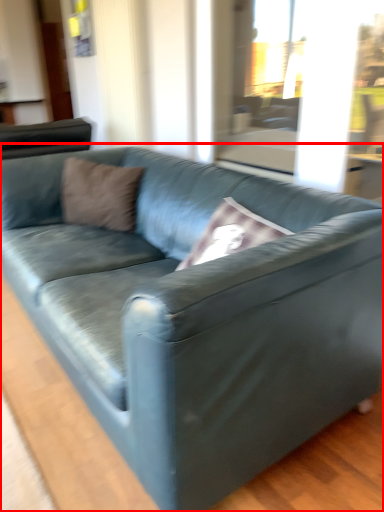
Question: From the image's perspective, what is the correct spatial relationship of studio couch (annotated by the red box) in relation to pillow?

Choices:
 (A) above
 (B) below

Answer: (B)